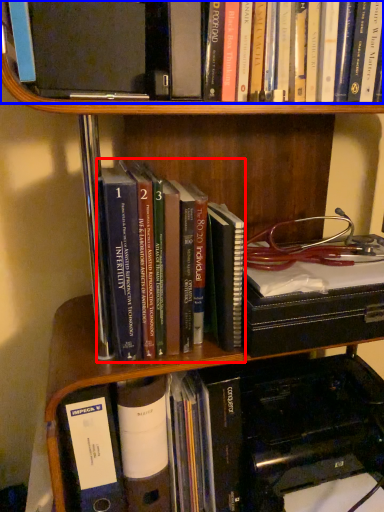
Question: Which object is further to the camera taking this photo, book (highlighted by a red box) or book (highlighted by a blue box)?

Choices:
 (A) book
 (B) book

Answer: (A)